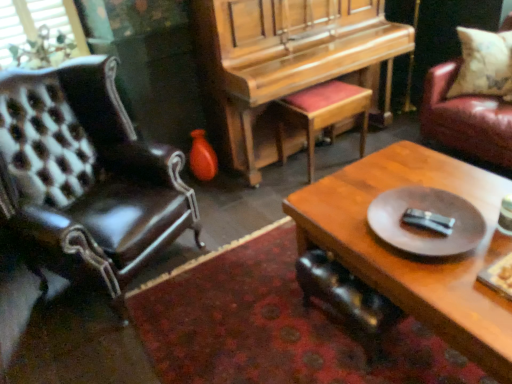
Find the location of a particular element. This screenshot has width=512, height=384. velvet red stool at center is located at coordinates (322, 114).

This screenshot has width=512, height=384. What do you see at coordinates (484, 64) in the screenshot? I see `floral-patterned fabric pillow at upper right` at bounding box center [484, 64].

Measure the distance between white mesh window screen at upper left and camera.

white mesh window screen at upper left is 2.28 meters away from camera.

What do you see at coordinates (428, 221) in the screenshot? This screenshot has width=512, height=384. I see `black plastic remote control at center` at bounding box center [428, 221].

You are a GUI agent. You are given a task and a screenshot of the screen. Output one action in this format:
    pyautogui.click(x=<x>, y=<y>)
    Task: Click on the shiny orange vase at center
    The height and width of the screenshot is (384, 512).
    Given the screenshot: What is the action you would take?
    pyautogui.click(x=202, y=157)

Is shiny black leather chair at lower center, marked as the 1th chair in a right-to-left arrangement, touching leather cushion at right?

No, shiny black leather chair at lower center, marked as the 1th chair in a right-to-left arrangement, is not beside leather cushion at right.

The image size is (512, 384). In order to click on the 1st chair to the left of the leather cushion at right, starting your count from the anchor in this screenshot , I will do `click(347, 299)`.

From the image's perspective, does shiny black leather chair at lower center, the second chair positioned from the left, appear higher than leather cushion at right?

Incorrect, from the image's perspective, shiny black leather chair at lower center, the second chair positioned from the left, is lower than leather cushion at right.

Is shiny black leather chair at lower center, marked as the 1th chair in a right-to-left arrangement, taller than leather cushion at right?

In fact, shiny black leather chair at lower center, marked as the 1th chair in a right-to-left arrangement, may be shorter than leather cushion at right.

Which is in front, shiny orange vase at center or white mesh window screen at upper left?

white mesh window screen at upper left.

From the image's perspective, between shiny orange vase at center and white mesh window screen at upper left, who is located below?

shiny orange vase at center, from the image's perspective.

Considering the positions of point (195, 137) and point (70, 9), is point (195, 137) closer or farther from the camera than point (70, 9)?

Point (195, 137) is positioned farther from the camera compared to point (70, 9).

Do you think shiny orange vase at center is within white mesh window screen at upper left, or outside of it?

shiny orange vase at center lies outside white mesh window screen at upper left.

Who is shorter, wooden piano at center or leather cushion at right?

Standing shorter between the two is leather cushion at right.

From the image's perspective, which one is positioned lower, wooden piano at center or leather cushion at right?

wooden piano at center is shown below in the image.

From a real-world perspective, is wooden piano at center under leather cushion at right?

Incorrect, from a real-world perspective, wooden piano at center is higher than leather cushion at right.

Visually, is wooden piano at center positioned to the left or to the right of leather cushion at right?

Clearly, wooden piano at center is on the left of leather cushion at right in the image.

Image resolution: width=512 pixels, height=384 pixels. I want to click on cabinetry in front of the white mesh window screen at upper left, so click(283, 59).

Is the surface of white mesh window screen at upper left in direct contact with wooden piano at center?

There is a gap between white mesh window screen at upper left and wooden piano at center.

Is white mesh window screen at upper left taller than wooden piano at center?

No, white mesh window screen at upper left is not taller than wooden piano at center.

Is white mesh window screen at upper left inside the boundaries of wooden piano at center, or outside?

white mesh window screen at upper left exists outside the volume of wooden piano at center.

From the image's perspective, is shiny black leather chair at lower center, the second chair positioned from the left, above or below wooden piano at center?

Based on their image positions, shiny black leather chair at lower center, the second chair positioned from the left, is located beneath wooden piano at center.

Does shiny black leather chair at lower center, the second chair positioned from the left, turn towards wooden piano at center?

No, shiny black leather chair at lower center, the second chair positioned from the left, is not turned towards wooden piano at center.

Is shiny black leather chair at lower center, marked as the 1th chair in a right-to-left arrangement, taller or shorter than wooden piano at center?

In the image, shiny black leather chair at lower center, marked as the 1th chair in a right-to-left arrangement, appears to be shorter than wooden piano at center.

Which object is positioned more to the left, shiny black leather chair at lower center, the second chair positioned from the left, or wooden piano at center?

wooden piano at center.

The width and height of the screenshot is (512, 384). What are the coordinates of `the 2nd chair in front when counting from the white mesh window screen at upper left` in the screenshot? It's located at click(87, 174).

Between leather chair at left, which is counted as the 1th chair, starting from the left, and white mesh window screen at upper left, which one has smaller size?

white mesh window screen at upper left is smaller.

Which is closer to the camera, (73, 77) or (22, 29)?

Positioned in front is point (73, 77).

Which is less distant, (368, 270) or (376, 306)?

Point (368, 270) is closer to the camera than point (376, 306).

Which object is further away from the camera taking this photo, wooden coffee table at center or shiny black leather chair at lower center, the second chair positioned from the left?

Positioned behind is shiny black leather chair at lower center, the second chair positioned from the left.

Is wooden coffee table at center positioned beyond the bounds of shiny black leather chair at lower center, the second chair positioned from the left?

That's correct, wooden coffee table at center is outside of shiny black leather chair at lower center, the second chair positioned from the left.

Considering the sizes of objects wooden coffee table at center and shiny black leather chair at lower center, the second chair positioned from the left, in the image provided, who is thinner, wooden coffee table at center or shiny black leather chair at lower center, the second chair positioned from the left,?

With smaller width is shiny black leather chair at lower center, the second chair positioned from the left.

From the leather cushion at right, count 1st chairs forward and point to it. Please provide its 2D coordinates.

[(347, 299)]

What are the coordinates of `vase below the white mesh window screen at upper left (from the image's perspective)` in the screenshot? It's located at (202, 157).

Considering their positions, is wooden coffee table at center positioned closer to floral-patterned fabric pillow at upper right than wooden piano at center?

Based on the image, wooden piano at center appears to be nearer to floral-patterned fabric pillow at upper right.

Estimate the real-world distances between objects in this image. Which object is further from velvet red stool at center, floral-patterned fabric pillow at upper right or wooden piano at center?

Based on the image, floral-patterned fabric pillow at upper right appears to be further to velvet red stool at center.

Considering their positions, is leather chair at left, the second chair viewed from the right, positioned closer to white mesh window screen at upper left than velvet red stool at center?

leather chair at left, the second chair viewed from the right.

From the image, which object appears to be nearer to shiny orange vase at center, wooden piano at center or wooden coffee table at center?

wooden piano at center lies closer to shiny orange vase at center than the other object.

Considering their positions, is black plastic remote control at center positioned closer to leather cushion at right than white mesh window screen at upper left?

black plastic remote control at center is positioned closer to the anchor leather cushion at right.

Looking at the image, which one is located further to leather cushion at right, leather chair at left, which is counted as the 1th chair, starting from the left, or white mesh window screen at upper left?

leather chair at left, which is counted as the 1th chair, starting from the left.

Looking at this image, based on their spatial positions, is white mesh window screen at upper left or velvet red stool at center further from shiny black leather chair at lower center, the second chair positioned from the left?

white mesh window screen at upper left.

In the scene shown: When comparing their distances from wooden piano at center, does black plastic remote control at center or leather cushion at right seem further?

black plastic remote control at center is positioned further to the anchor wooden piano at center.

Where is `remote control between white mesh window screen at upper left and leather cushion at right`? The image size is (512, 384). remote control between white mesh window screen at upper left and leather cushion at right is located at coordinates (x=428, y=221).

The image size is (512, 384). What are the coordinates of `remote control between wooden coffee table at center and leather cushion at right in the front-back direction` in the screenshot? It's located at tap(428, 221).

Where is `chair between black plastic remote control at center and leather cushion at right along the z-axis`? This screenshot has height=384, width=512. chair between black plastic remote control at center and leather cushion at right along the z-axis is located at coordinates (347, 299).

You are a GUI agent. You are given a task and a screenshot of the screen. Output one action in this format:
    pyautogui.click(x=<x>, y=<y>)
    Task: Click on the cabinetry situated between shiny orange vase at center and velvet red stool at center from left to right
    
    Given the screenshot: What is the action you would take?
    pyautogui.click(x=283, y=59)